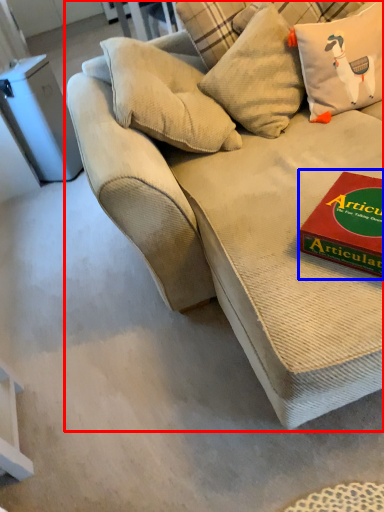
Question: Which object appears farthest to the camera in this image, studio couch (highlighted by a red box) or paperback book (highlighted by a blue box)?

Choices:
 (A) studio couch
 (B) paperback book

Answer: (B)